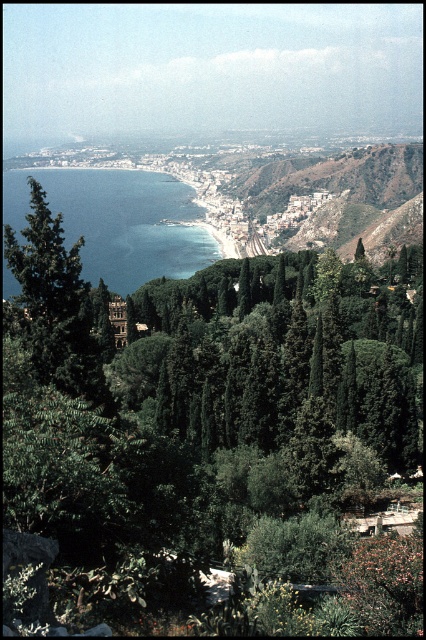
This screenshot has width=426, height=640. What do you see at coordinates (348, 196) in the screenshot?
I see `green leafy hillside at center` at bounding box center [348, 196].

Who is taller, green leafy hillside at center or green matte tree at left?

Standing taller between the two is green leafy hillside at center.

Image resolution: width=426 pixels, height=640 pixels. Find the location of `green leafy hillside at center`. green leafy hillside at center is located at coordinates (348, 196).

Between blue liquid water at center-left and green leafy hillside at center, which one is positioned higher?

Positioned higher is green leafy hillside at center.

Is point (173, 188) positioned after point (331, 173)?

That is True.

Does point (106, 257) lie in front of point (382, 188)?

Yes, point (106, 257) is in front of point (382, 188).

This screenshot has height=640, width=426. Find the location of `blue liquid water at center-left`. blue liquid water at center-left is located at coordinates (118, 221).

Which is below, blue liquid water at center-left or green matte tree at left?

Positioned lower is green matte tree at left.

Does blue liquid water at center-left have a greater height compared to green matte tree at left?

Yes, blue liquid water at center-left is taller than green matte tree at left.

Describe the element at coordinates (118, 221) in the screenshot. I see `blue liquid water at center-left` at that location.

Where is `blue liquid water at center-left`? blue liquid water at center-left is located at coordinates (118, 221).